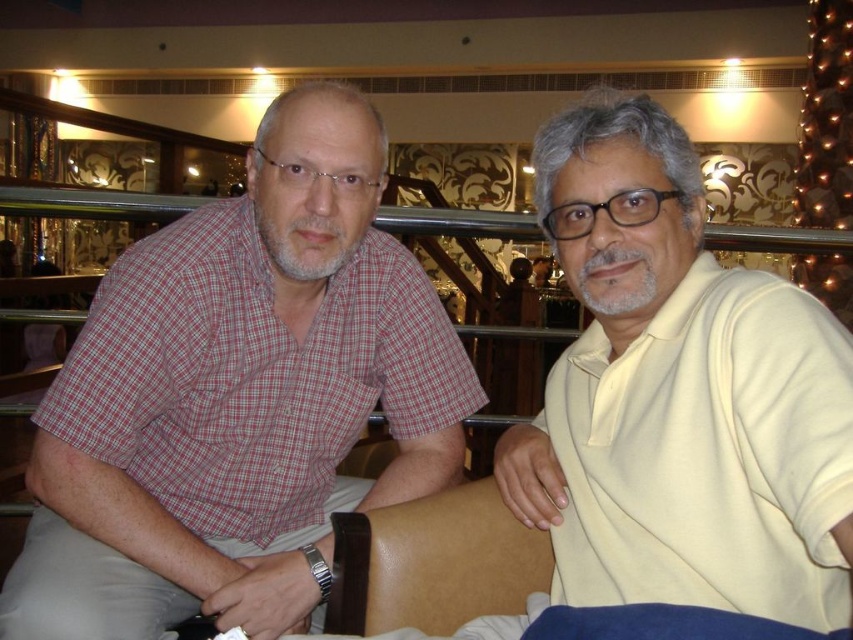
Does red checkered shirt at left come behind yellow matte shirt at right?

Yes, it is.

Is red checkered shirt at left to the left of yellow matte shirt at right from the viewer's perspective?

Correct, you'll find red checkered shirt at left to the left of yellow matte shirt at right.

Find the location of a particular element. The width and height of the screenshot is (853, 640). red checkered shirt at left is located at coordinates (238, 397).

Does red checkered shirt at left have a lesser width compared to brown leather chair at center?

No, red checkered shirt at left is not thinner than brown leather chair at center.

Can you confirm if red checkered shirt at left is positioned above brown leather chair at center?

Yes.

You are a GUI agent. You are given a task and a screenshot of the screen. Output one action in this format:
    pyautogui.click(x=<x>, y=<y>)
    Task: Click on the red checkered shirt at left
    The image size is (853, 640).
    Given the screenshot: What is the action you would take?
    pyautogui.click(x=238, y=397)

Locate an element on the screen. The height and width of the screenshot is (640, 853). red checkered shirt at left is located at coordinates (238, 397).

Between point (631, 280) and point (397, 534), which one is positioned in front?

Point (631, 280) is more forward.

This screenshot has width=853, height=640. What do you see at coordinates (679, 396) in the screenshot?
I see `yellow matte shirt at right` at bounding box center [679, 396].

Between point (602, 384) and point (426, 536), which one is positioned in front?

Positioned in front is point (602, 384).

In order to click on yellow matte shirt at right in this screenshot , I will do coord(679,396).